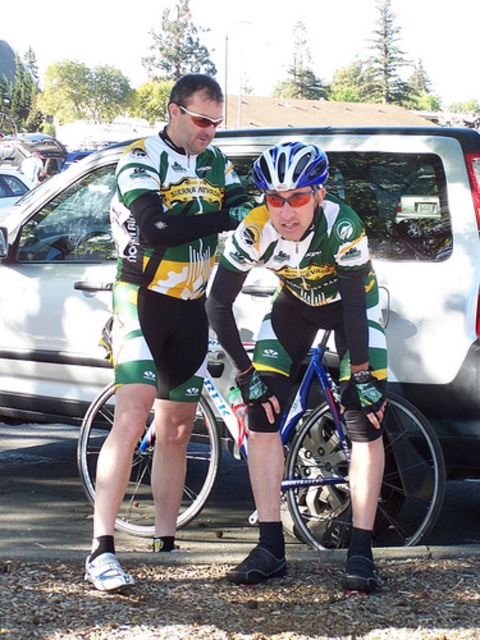
Which is behind, point (214, 237) or point (250, 438)?

Point (214, 237)

Is matte green jersey at center further to the viewer compared to green jersey at center?

That is True.

Identify the location of matte green jersey at center. (162, 305).

Identify the location of matte green jersey at center. (162, 305).

Can you confirm if white glossy car at left is positioned to the right of blue reflective lens glasses at center?

No, white glossy car at left is not to the right of blue reflective lens glasses at center.

Is white glossy car at left further to camera compared to blue reflective lens glasses at center?

Yes, white glossy car at left is further from the viewer.

In order to click on white glossy car at left in this screenshot , I will do `click(12, 188)`.

Does blue glossy bicycle helmet at center have a greater height compared to blue reflective lens glasses at center?

Indeed, blue glossy bicycle helmet at center has a greater height compared to blue reflective lens glasses at center.

Can you confirm if blue glossy bicycle helmet at center is positioned to the right of blue reflective lens glasses at center?

Indeed, blue glossy bicycle helmet at center is positioned on the right side of blue reflective lens glasses at center.

What do you see at coordinates (289, 168) in the screenshot?
I see `blue glossy bicycle helmet at center` at bounding box center [289, 168].

At what (x,y) coordinates should I click in order to perform the action: click on blue glossy bicycle helmet at center. Please return your answer as a coordinate pair (x, y). The height and width of the screenshot is (640, 480). Looking at the image, I should click on (289, 168).